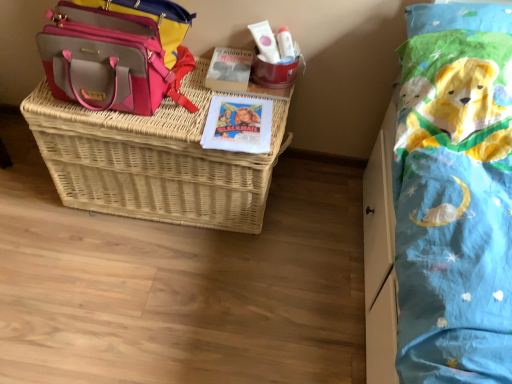
The height and width of the screenshot is (384, 512). Identify the location of woven wicker basket at center. (154, 161).

Find the location of a particular element. The width and height of the screenshot is (512, 384). pink leather shoulder bag at upper left is located at coordinates (111, 59).

How many degrees apart are the facing directions of woven wicker basket at center and white matte tube at upper center?

There is a 0.0126-degree angle between the facing directions of woven wicker basket at center and white matte tube at upper center.

Is woven wicker basket at center further to the viewer compared to white matte tube at upper center?

No, it is in front of white matte tube at upper center.

Are woven wicker basket at center and white matte tube at upper center far apart?

woven wicker basket at center is actually quite close to white matte tube at upper center.

Which object is further away from the camera, pink leather shoulder bag at upper left or white matte tube at upper center?

white matte tube at upper center is more distant.

Are pink leather shoulder bag at upper left and white matte tube at upper center beside each other?

No, pink leather shoulder bag at upper left is not beside white matte tube at upper center.

Between pink leather shoulder bag at upper left and white matte tube at upper center, which one has more height?

Standing taller between the two is pink leather shoulder bag at upper left.

In the scene shown: Is pink leather shoulder bag at upper left wider or thinner than woven wicker basket at center?

In the image, pink leather shoulder bag at upper left appears to be more narrow than woven wicker basket at center.

How far apart are pink leather shoulder bag at upper left and woven wicker basket at center?

pink leather shoulder bag at upper left and woven wicker basket at center are 7.35 inches apart.

Based on the photo, is pink leather shoulder bag at upper left beside woven wicker basket at center?

No, pink leather shoulder bag at upper left is not beside woven wicker basket at center.

How different are the orientations of pink leather shoulder bag at upper left and woven wicker basket at center in degrees?

pink leather shoulder bag at upper left and woven wicker basket at center are facing 5.54e-05 degrees away from each other.

Measure the distance between woven wicker basket at center and pink leather shoulder bag at upper left.

A distance of 7.35 inches exists between woven wicker basket at center and pink leather shoulder bag at upper left.

Looking at this image, in terms of size, does woven wicker basket at center appear bigger or smaller than pink leather shoulder bag at upper left?

woven wicker basket at center is bigger than pink leather shoulder bag at upper left.

The image size is (512, 384). What are the coordinates of `picnic basket below the pink leather shoulder bag at upper left (from the image's perspective)` in the screenshot? It's located at (154, 161).

Would you say woven wicker basket at center is a long distance from pink leather shoulder bag at upper left?

No, woven wicker basket at center is not far away from pink leather shoulder bag at upper left.

Is white matte tube at upper center oriented away from pink leather shoulder bag at upper left?

That's not correct — white matte tube at upper center is not looking away from pink leather shoulder bag at upper left.

Is white matte tube at upper center beside pink leather shoulder bag at upper left?

white matte tube at upper center is not next to pink leather shoulder bag at upper left, and they're not touching.

At what (x,y) coordinates should I click in order to perform the action: click on toiletry below the pink leather shoulder bag at upper left (from a real-world perspective). Please return your answer as a coordinate pair (x, y). The width and height of the screenshot is (512, 384). Looking at the image, I should click on (265, 42).

Can you tell me how much white matte tube at upper center and woven wicker basket at center differ in facing direction?

There is a 0.0126-degree angle between the facing directions of white matte tube at upper center and woven wicker basket at center.

Based on the photo, could you tell me if white matte tube at upper center is turned towards woven wicker basket at center?

No, white matte tube at upper center is not oriented towards woven wicker basket at center.

Considering their positions, is white matte tube at upper center located in front of or behind woven wicker basket at center?

Clearly, white matte tube at upper center is behind woven wicker basket at center.

Image resolution: width=512 pixels, height=384 pixels. Identify the location of toiletry on the right of woven wicker basket at center. (265, 42).

Where is `shoulder bag above the white matte tube at upper center (from a real-world perspective)`? shoulder bag above the white matte tube at upper center (from a real-world perspective) is located at coordinates (111, 59).

Looking at the image, which one is located closer to pink leather shoulder bag at upper left, woven wicker basket at center or white matte tube at upper center?

woven wicker basket at center lies closer to pink leather shoulder bag at upper left than the other object.

Considering their positions, is woven wicker basket at center positioned closer to white matte tube at upper center than pink leather shoulder bag at upper left?

pink leather shoulder bag at upper left is closer to white matte tube at upper center.

Based on their spatial positions, is white matte tube at upper center or pink leather shoulder bag at upper left closer to woven wicker basket at center?

pink leather shoulder bag at upper left lies closer to woven wicker basket at center than the other object.

Looking at this image, based on their spatial positions, is pink leather shoulder bag at upper left or white matte tube at upper center closer to woven wicker basket at center?

Among the two, pink leather shoulder bag at upper left is located nearer to woven wicker basket at center.

Estimate the real-world distances between objects in this image. Which object is closer to pink leather shoulder bag at upper left, white matte tube at upper center or woven wicker basket at center?

woven wicker basket at center is closer to pink leather shoulder bag at upper left.

Considering their positions, is pink leather shoulder bag at upper left positioned further to white matte tube at upper center than woven wicker basket at center?

Among the two, woven wicker basket at center is located further to white matte tube at upper center.

Image resolution: width=512 pixels, height=384 pixels. Find the location of `picnic basket situated between pink leather shoulder bag at upper left and white matte tube at upper center from left to right`. picnic basket situated between pink leather shoulder bag at upper left and white matte tube at upper center from left to right is located at coordinates (154, 161).